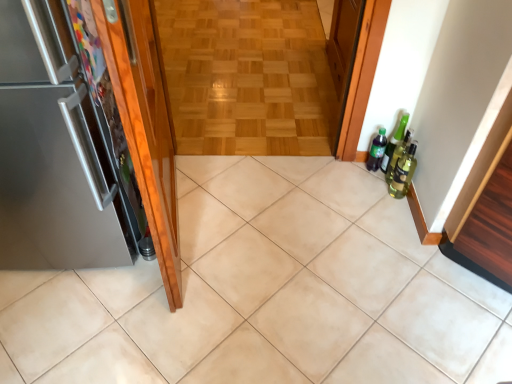
Where is `blank space to the left of green glass bottle at right, the 1th beer bottle viewed from the front`? Image resolution: width=512 pixels, height=384 pixels. blank space to the left of green glass bottle at right, the 1th beer bottle viewed from the front is located at coordinates (359, 192).